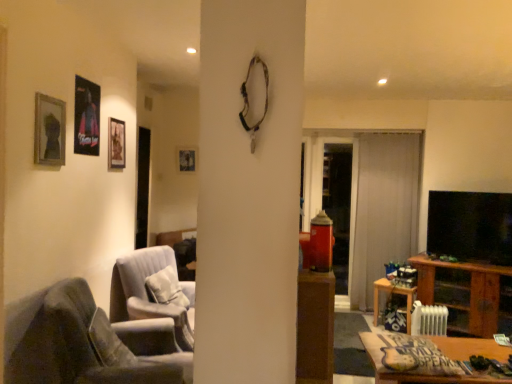
Question: From a real-world perspective, is white sheer curtain at center located beneath wooden frame at upper left, placed as the 4th picture frame when sorted from right to left?

Choices:
 (A) no
 (B) yes

Answer: (B)

Question: Considering the relative sizes of white sheer curtain at center and wooden frame at upper left, which ranks as the first picture frame in left-to-right order, in the image provided, is white sheer curtain at center shorter than wooden frame at upper left, which ranks as the first picture frame in left-to-right order,?

Choices:
 (A) yes
 (B) no

Answer: (B)

Question: Is white sheer curtain at center positioned behind wooden frame at upper left, which is counted as the first picture frame, starting from the front?

Choices:
 (A) no
 (B) yes

Answer: (B)

Question: Are white sheer curtain at center and wooden frame at upper left, which is counted as the first picture frame, starting from the front, far apart?

Choices:
 (A) yes
 (B) no

Answer: (A)

Question: Is white sheer curtain at center looking in the opposite direction of wooden frame at upper left, placed as the 4th picture frame when sorted from right to left?

Choices:
 (A) yes
 (B) no

Answer: (B)

Question: Does white sheer curtain at center have a smaller size compared to wooden frame at upper left, placed as the 4th picture frame when sorted from right to left?

Choices:
 (A) yes
 (B) no

Answer: (B)

Question: Are wooden table at lower right, acting as the 1th table starting from the front, and velvet white armchair at center, placed as the second chair when sorted from front to back, far apart?

Choices:
 (A) no
 (B) yes

Answer: (B)

Question: Is wooden table at lower right, marked as the first table in a top-to-bottom arrangement, turned away from velvet white armchair at center, placed as the second chair when sorted from front to back?

Choices:
 (A) no
 (B) yes

Answer: (A)

Question: Is the depth of wooden table at lower right, which appears as the second table when viewed from the right, less than that of velvet white armchair at center, placed as the second chair when sorted from front to back?

Choices:
 (A) no
 (B) yes

Answer: (B)

Question: Considering the relative positions of wooden table at lower right, marked as the first table in a top-to-bottom arrangement, and velvet white armchair at center, marked as the first chair in a back-to-front arrangement, in the image provided, is wooden table at lower right, marked as the first table in a top-to-bottom arrangement, to the right of velvet white armchair at center, marked as the first chair in a back-to-front arrangement, from the viewer's perspective?

Choices:
 (A) no
 (B) yes

Answer: (B)

Question: Considering the relative sizes of wooden table at lower right, marked as the first table in a top-to-bottom arrangement, and velvet white armchair at center, placed as the second chair when sorted from front to back, in the image provided, is wooden table at lower right, marked as the first table in a top-to-bottom arrangement, smaller than velvet white armchair at center, placed as the second chair when sorted from front to back,?

Choices:
 (A) yes
 (B) no

Answer: (A)

Question: Can you confirm if wooden table at lower right, acting as the 1th table starting from the front, is thinner than velvet white armchair at center, marked as the first chair in a back-to-front arrangement?

Choices:
 (A) yes
 (B) no

Answer: (B)

Question: Considering the relative sizes of velvet white armchair at center, placed as the second chair when sorted from front to back, and matte black picture frame at upper left, which is counted as the 2th picture frame, starting from the right, in the image provided, is velvet white armchair at center, placed as the second chair when sorted from front to back, shorter than matte black picture frame at upper left, which is counted as the 2th picture frame, starting from the right,?

Choices:
 (A) no
 (B) yes

Answer: (A)